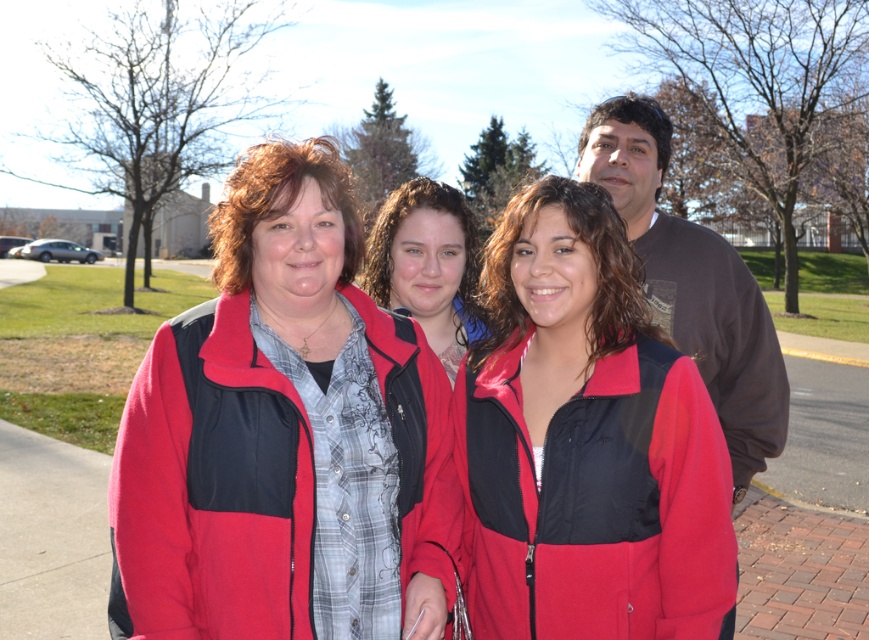
Question: Is red fleece jackets at center thinner than dark gray cotton shirt at upper right?

Choices:
 (A) yes
 (B) no

Answer: (B)

Question: Which object is closer to the camera taking this photo?

Choices:
 (A) red fleece jacket at center
 (B) red fleece jackets at center

Answer: (B)

Question: Considering the relative positions of matte fleece jacket at center and dark gray cotton shirt at upper right in the image provided, where is matte fleece jacket at center located with respect to dark gray cotton shirt at upper right?

Choices:
 (A) below
 (B) above

Answer: (A)

Question: Which point is closer to the camera taking this photo?

Choices:
 (A) (774, 432)
 (B) (290, 596)
 (C) (750, 365)

Answer: (B)

Question: Observing the image, what is the correct spatial positioning of red fleece jackets at center in reference to dark gray cotton shirt at upper right?

Choices:
 (A) above
 (B) below

Answer: (A)

Question: Which of the following is the farthest from the observer?

Choices:
 (A) coord(661,285)
 (B) coord(483,600)

Answer: (A)